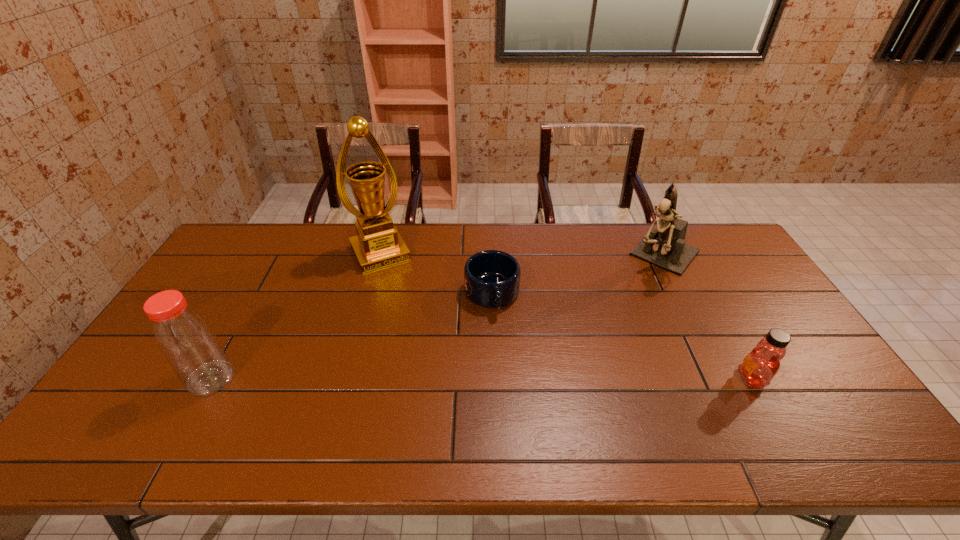
At what (x,y) coordinates should I click in order to perform the action: click on free space on the desktop that is between the bottle and the fourth tallest object and is positioned on the front-facing side of the award. Please return your answer as a coordinate pair (x, y). Looking at the image, I should click on (444, 378).

You are a GUI agent. You are given a task and a screenshot of the screen. Output one action in this format:
    pyautogui.click(x=<x>, y=<y>)
    Task: Click on the free space on the desktop that is between the leftmost object and the fourth tallest object and is positioned on the front-facing side of the figurine
    
    Given the screenshot: What is the action you would take?
    pyautogui.click(x=563, y=378)

I want to click on free space on the desktop that is between the bottle and the honey and is positioned with the handle on the side of the third object from right to left, so click(511, 378).